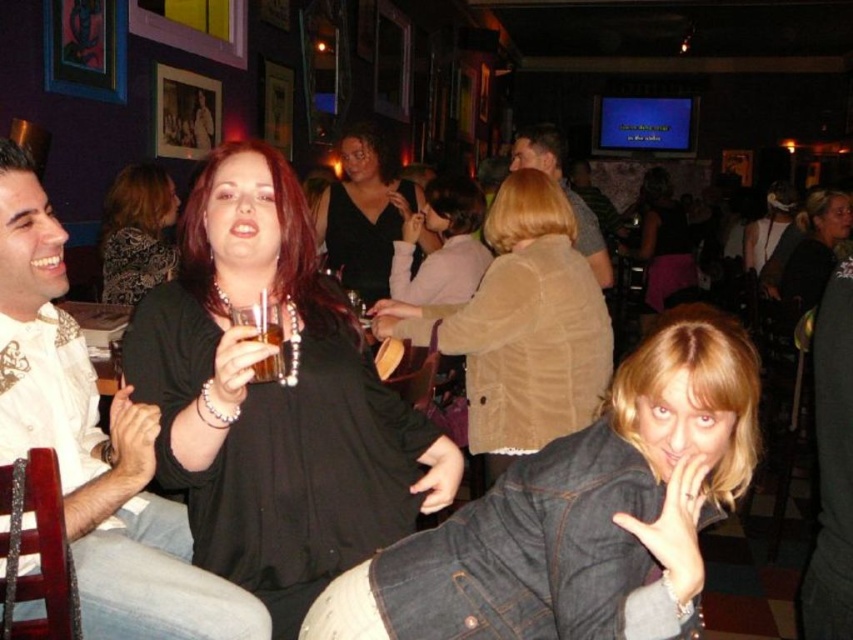
Question: Which object is farther from the camera taking this photo?

Choices:
 (A) suede jacket at center
 (B) white textured shirt at left

Answer: (A)

Question: Is the position of black velvet dress at center more distant than that of light brown leather jacket at center?

Choices:
 (A) yes
 (B) no

Answer: (A)

Question: Which object is farther from the camera taking this photo?

Choices:
 (A) light brown leather jacket at center
 (B) patterned fabric dress at center
 (C) black velvet dress at center
 (D) black matte shirt at center

Answer: (C)

Question: Can you confirm if white textured shirt at left is positioned to the left of translucent glass at center?

Choices:
 (A) no
 (B) yes

Answer: (B)

Question: Is denim jacket at lower right thinner than patterned fabric dress at center?

Choices:
 (A) no
 (B) yes

Answer: (A)

Question: Considering the real-world distances, which object is farthest from the suede jacket at center?

Choices:
 (A) black matte shirt at center
 (B) translucent glass at center
 (C) black velvet dress at center
 (D) matte black dress at center

Answer: (D)